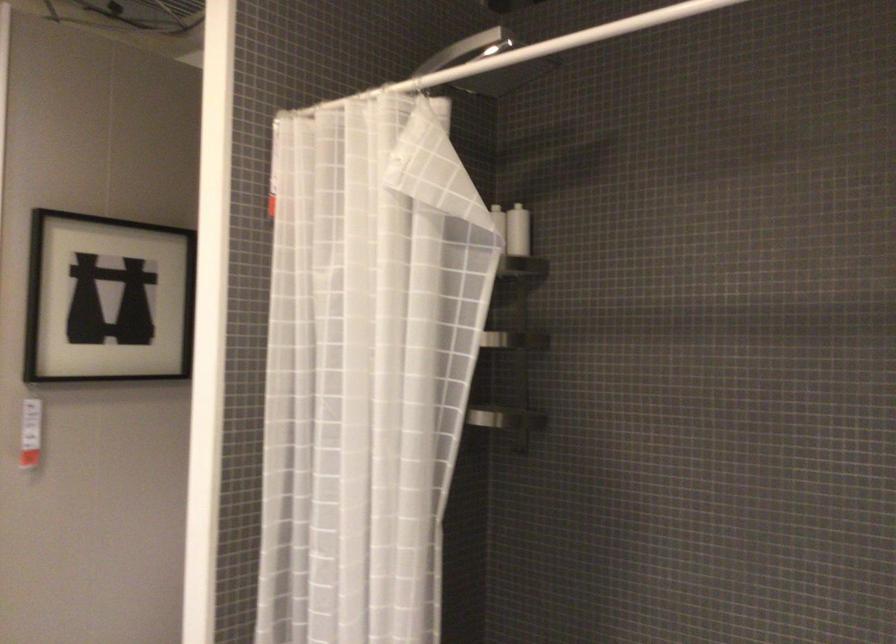
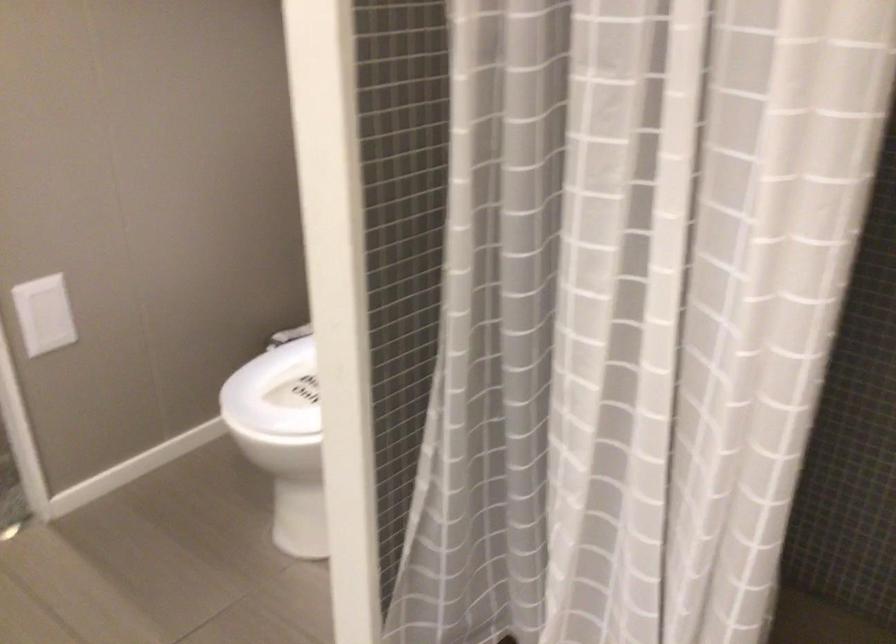
Question: The first image is from the beginning of the video and the second image is from the end. How did the camera likely rotate when shooting the video?

Choices:
 (A) Left
 (B) Right
 (C) Up
 (D) Down

Answer: (D)